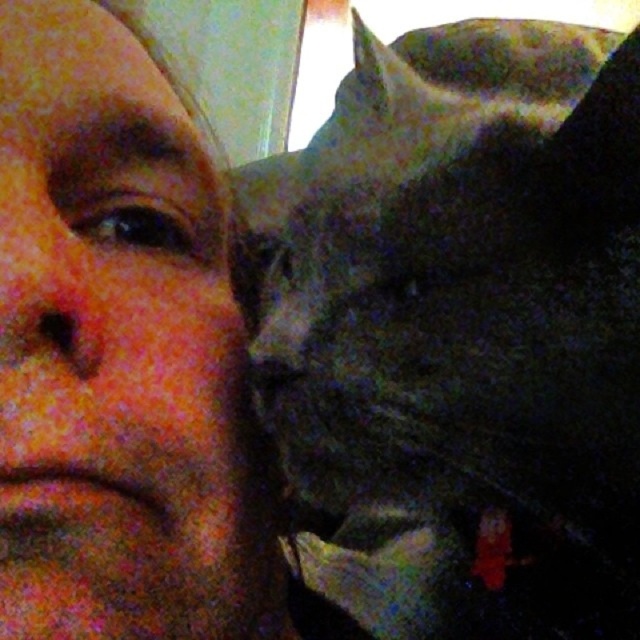
Does dark gray fur at right have a lesser height compared to matte skin at center?

Incorrect, dark gray fur at right's height does not fall short of matte skin at center's.

Identify the location of dark gray fur at right. This screenshot has height=640, width=640. (458, 332).